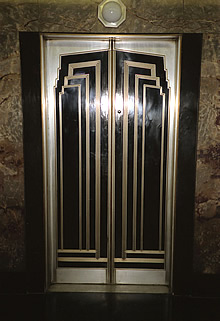
Locate an element on the screen. black and silver elevator is located at coordinates (102, 172).